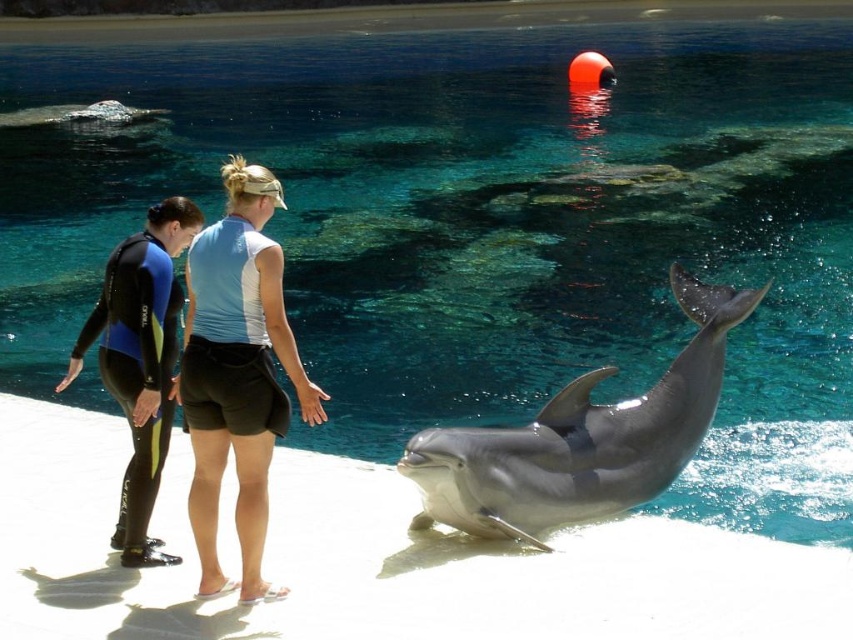
Question: Is smooth gray dolphin at center positioned behind black neoprene wetsuit at left?

Choices:
 (A) yes
 (B) no

Answer: (A)

Question: From the image, what is the correct spatial relationship of smooth gray dolphin at center in relation to black neoprene wetsuit at left?

Choices:
 (A) right
 (B) left

Answer: (A)

Question: Which point is farther from the camera taking this photo?

Choices:
 (A) pos(593,477)
 (B) pos(254,221)

Answer: (A)

Question: Among these objects, which one is nearest to the camera?

Choices:
 (A) black neoprene wetsuit at left
 (B) smooth gray dolphin at center

Answer: (A)

Question: Where is smooth gray dolphin at center located in relation to blue fabric shorts at center in the image?

Choices:
 (A) right
 (B) left

Answer: (A)

Question: Which of the following is the closest to the observer?

Choices:
 (A) blue fabric shorts at center
 (B) smooth gray dolphin at center

Answer: (A)